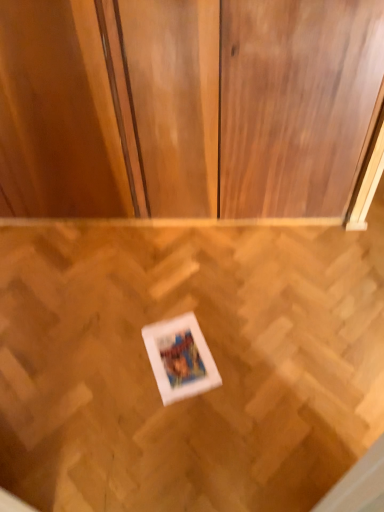
Question: Is matte wood dresser at center in front of or behind wooden parquet floor at center in the image?

Choices:
 (A) behind
 (B) front

Answer: (A)

Question: Would you say matte wood dresser at center is to the left or to the right of wooden parquet floor at center in the picture?

Choices:
 (A) left
 (B) right

Answer: (A)

Question: Which object is the farthest from the white matte picture frame at center?

Choices:
 (A) wooden parquet floor at center
 (B) matte wood dresser at center

Answer: (B)

Question: Which of these objects is positioned closest to the matte wood dresser at center?

Choices:
 (A) white matte picture frame at center
 (B) wooden parquet floor at center

Answer: (B)